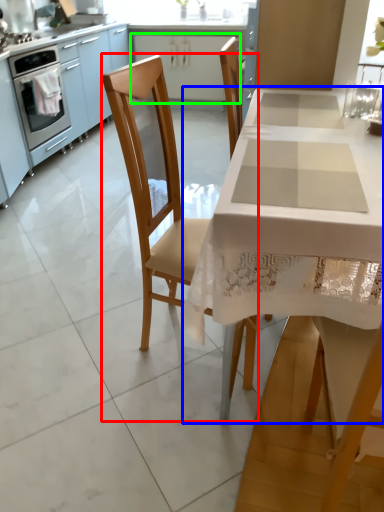
Question: Based on their relative distances, which object is farther from chair (highlighted by a red box)? Choose from table (highlighted by a blue box) and cabinetry (highlighted by a green box).

Choices:
 (A) table
 (B) cabinetry

Answer: (B)